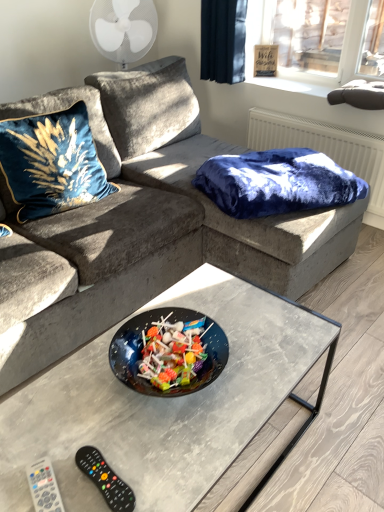
Describe the element at coordinates (105, 479) in the screenshot. The width and height of the screenshot is (384, 512). I see `black plastic remote at lower left, marked as the first remote in a right-to-left arrangement` at that location.

Locate an element on the screen. This screenshot has width=384, height=512. velvet blue pillow at upper left is located at coordinates (50, 163).

This screenshot has width=384, height=512. I want to click on velvet blue blanket at upper right, so click(277, 183).

The image size is (384, 512). What are the coordinates of `velvet fabric couch at center` in the screenshot? It's located at (153, 220).

This screenshot has height=512, width=384. I want to click on blanket above the black plastic remote at lower left, which ranks as the 2th remote in left-to-right order (from a real-world perspective), so click(277, 183).

Considering the relative positions of black plastic remote at lower left, marked as the first remote in a right-to-left arrangement, and velvet blue blanket at upper right in the image provided, is black plastic remote at lower left, marked as the first remote in a right-to-left arrangement, to the left of velvet blue blanket at upper right from the viewer's perspective?

Indeed, black plastic remote at lower left, marked as the first remote in a right-to-left arrangement, is positioned on the left side of velvet blue blanket at upper right.

Does black plastic remote at lower left, which ranks as the 2th remote in left-to-right order, have a greater height compared to velvet blue blanket at upper right?

No, black plastic remote at lower left, which ranks as the 2th remote in left-to-right order, is not taller than velvet blue blanket at upper right.

In the scene shown: From a real-world perspective, which object stands above the other?

velvet blue blanket at upper right.

From a real-world perspective, is white plastic remote at lower left, the first remote positioned from the left, positioned above or below velvet blue blanket at upper right?

Clearly, from a real-world perspective, white plastic remote at lower left, the first remote positioned from the left, is below velvet blue blanket at upper right.

Could you tell me if white plastic remote at lower left, which is the second remote in right-to-left order, is turned towards velvet blue blanket at upper right?

No, white plastic remote at lower left, which is the second remote in right-to-left order, is not aimed at velvet blue blanket at upper right.

Which point is more forward, (57, 509) or (350, 189)?

The point (57, 509) is closer to the camera.

Would you say velvet blue blanket at upper right is part of white plastic remote at lower left, which is the second remote in right-to-left order,'s contents?

No, velvet blue blanket at upper right is not surrounded by white plastic remote at lower left, which is the second remote in right-to-left order.

From the picture: Considering the relative positions of velvet blue blanket at upper right and velvet fabric couch at center in the image provided, is velvet blue blanket at upper right to the left or to the right of velvet fabric couch at center?

velvet blue blanket at upper right is to the right of velvet fabric couch at center.

At what (x,y) coordinates should I click in order to perform the action: click on studio couch below the velvet blue blanket at upper right (from a real-world perspective). Please return your answer as a coordinate pair (x, y). Looking at the image, I should click on (153, 220).

Which is nearer, (210, 193) or (59, 283)?

Positioned in front is point (59, 283).

Considering the sizes of velvet blue blanket at upper right and velvet fabric couch at center in the image, is velvet blue blanket at upper right wider or thinner than velvet fabric couch at center?

In the image, velvet blue blanket at upper right appears to be more narrow than velvet fabric couch at center.

Find the location of a particular element. blanket behind the white plastic remote at lower left, the first remote positioned from the left is located at coordinates (277, 183).

Does velvet blue blanket at upper right have a greater height compared to white plastic remote at lower left, which is the second remote in right-to-left order?

Yes, velvet blue blanket at upper right is taller than white plastic remote at lower left, which is the second remote in right-to-left order.

Is velvet blue blanket at upper right facing away from white plastic remote at lower left, the first remote positioned from the left?

No, velvet blue blanket at upper right's orientation is not away from white plastic remote at lower left, the first remote positioned from the left.

From a real-world perspective, is velvet blue blanket at upper right positioned under white plastic remote at lower left, which is the second remote in right-to-left order, based on gravity?

No.

Which object is positioned more to the left, velvet fabric couch at center or velvet blue blanket at upper right?

velvet fabric couch at center is more to the left.

Is the depth of velvet fabric couch at center greater than that of velvet blue blanket at upper right?

No, it is not.

Is velvet fabric couch at center thinner than velvet blue blanket at upper right?

No, velvet fabric couch at center is not thinner than velvet blue blanket at upper right.

This screenshot has height=512, width=384. What are the coordinates of `blanket above the velvet fabric couch at center (from a real-world perspective)` in the screenshot? It's located at (277, 183).

Is white plastic remote at lower left, the first remote positioned from the left, not within velvet blue pillow at upper left?

Yes.

Between white plastic remote at lower left, the first remote positioned from the left, and velvet blue pillow at upper left, which one has less height?

white plastic remote at lower left, the first remote positioned from the left.

From a real-world perspective, between white plastic remote at lower left, the first remote positioned from the left, and velvet blue pillow at upper left, who is vertically higher?

velvet blue pillow at upper left, from a real-world perspective.

Is white plastic remote at lower left, the first remote positioned from the left, next to velvet blue pillow at upper left and touching it?

No, white plastic remote at lower left, the first remote positioned from the left, is not making contact with velvet blue pillow at upper left.

Is white plastic remote at lower left, which is the second remote in right-to-left order, outside of velvet fabric couch at center?

That's correct, white plastic remote at lower left, which is the second remote in right-to-left order, is outside of velvet fabric couch at center.

Looking at their sizes, would you say white plastic remote at lower left, the first remote positioned from the left, is wider or thinner than velvet fabric couch at center?

Considering their sizes, white plastic remote at lower left, the first remote positioned from the left, looks slimmer than velvet fabric couch at center.

From the image's perspective, is white plastic remote at lower left, which is the second remote in right-to-left order, on velvet fabric couch at center?

No, from the image's perspective, white plastic remote at lower left, which is the second remote in right-to-left order, is not on top of velvet fabric couch at center.

Image resolution: width=384 pixels, height=512 pixels. In order to click on blanket on the right of the black plastic remote at lower left, marked as the first remote in a right-to-left arrangement in this screenshot , I will do `click(277, 183)`.

Locate an element on the screen. the 2nd remote in front of the velvet blue blanket at upper right, starting your count from the anchor is located at coordinates (44, 487).

Which object lies nearer to the anchor point velvet blue pillow at upper left, velvet blue blanket at upper right or white plastic remote at lower left, which is the second remote in right-to-left order?

Based on the image, velvet blue blanket at upper right appears to be nearer to velvet blue pillow at upper left.

Looking at the image, which one is located closer to black plastic remote at lower left, which ranks as the 2th remote in left-to-right order, velvet blue blanket at upper right or velvet fabric couch at center?

Among the two, velvet fabric couch at center is located nearer to black plastic remote at lower left, which ranks as the 2th remote in left-to-right order.

From the image, which object appears to be nearer to black plastic remote at lower left, which ranks as the 2th remote in left-to-right order, velvet fabric couch at center or velvet blue blanket at upper right?

The object closer to black plastic remote at lower left, which ranks as the 2th remote in left-to-right order, is velvet fabric couch at center.

From the image, which object appears to be farther from white plastic remote at lower left, the first remote positioned from the left, velvet blue pillow at upper left or velvet fabric couch at center?

Based on the image, velvet blue pillow at upper left appears to be further to white plastic remote at lower left, the first remote positioned from the left.

Estimate the real-world distances between objects in this image. Which object is further from velvet blue blanket at upper right, velvet fabric couch at center or black plastic remote at lower left, marked as the first remote in a right-to-left arrangement?

black plastic remote at lower left, marked as the first remote in a right-to-left arrangement, lies further to velvet blue blanket at upper right than the other object.

Which object lies further to the anchor point white plastic remote at lower left, which is the second remote in right-to-left order, velvet blue pillow at upper left or black plastic remote at lower left, marked as the first remote in a right-to-left arrangement?

velvet blue pillow at upper left lies further to white plastic remote at lower left, which is the second remote in right-to-left order, than the other object.

When comparing their distances from velvet blue blanket at upper right, does velvet blue pillow at upper left or black plastic remote at lower left, which ranks as the 2th remote in left-to-right order, seem further?

black plastic remote at lower left, which ranks as the 2th remote in left-to-right order, is positioned further to the anchor velvet blue blanket at upper right.

When comparing their distances from black plastic remote at lower left, marked as the first remote in a right-to-left arrangement, does velvet blue pillow at upper left or white plastic remote at lower left, the first remote positioned from the left, seem closer?

Based on the image, white plastic remote at lower left, the first remote positioned from the left, appears to be nearer to black plastic remote at lower left, marked as the first remote in a right-to-left arrangement.

At what (x,y) coordinates should I click in order to perform the action: click on studio couch between velvet blue pillow at upper left and black plastic remote at lower left, marked as the first remote in a right-to-left arrangement, in the vertical direction. Please return your answer as a coordinate pair (x, y). Looking at the image, I should click on (153, 220).

At what (x,y) coordinates should I click in order to perform the action: click on studio couch that lies between velvet blue pillow at upper left and white plastic remote at lower left, which is the second remote in right-to-left order, from top to bottom. Please return your answer as a coordinate pair (x, y). The image size is (384, 512). Looking at the image, I should click on tap(153, 220).

Where is `remote between velvet blue blanket at upper right and white plastic remote at lower left, which is the second remote in right-to-left order, vertically`? The height and width of the screenshot is (512, 384). remote between velvet blue blanket at upper right and white plastic remote at lower left, which is the second remote in right-to-left order, vertically is located at coordinates (105, 479).

You are a GUI agent. You are given a task and a screenshot of the screen. Output one action in this format:
    pyautogui.click(x=<x>, y=<y>)
    Task: Click on the throw pillow positioned between velvet fabric couch at center and velvet blue blanket at upper right from near to far
    This screenshot has width=384, height=512.
    Given the screenshot: What is the action you would take?
    pyautogui.click(x=50, y=163)